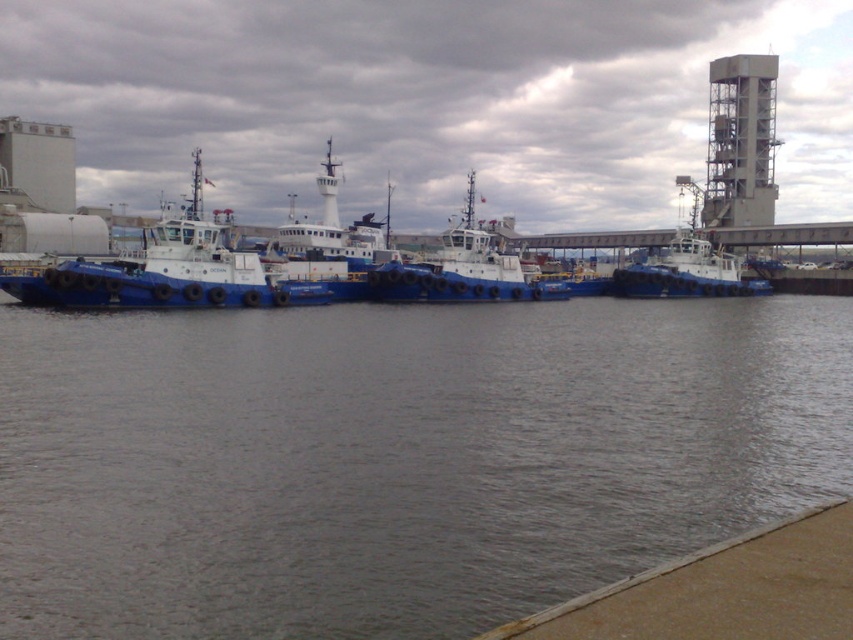
Question: Does blue rubber boat at center have a larger size compared to blue rubber boat at left?

Choices:
 (A) yes
 (B) no

Answer: (B)

Question: Which point is closer to the camera?

Choices:
 (A) (746, 284)
 (B) (120, 262)

Answer: (B)

Question: Is blue rubber boat at left positioned behind blue rubber boat at right?

Choices:
 (A) no
 (B) yes

Answer: (A)

Question: From the image, what is the correct spatial relationship of blue rubber boat at center in relation to blue rubber boat at right?

Choices:
 (A) below
 (B) above

Answer: (A)

Question: Which of the following is the farthest from the observer?

Choices:
 (A) (85, 291)
 (B) (187, 621)
 (C) (653, 292)

Answer: (C)

Question: Which object appears farthest from the camera in this image?

Choices:
 (A) blue rubber boat at right
 (B) blue rubber boat at left

Answer: (A)